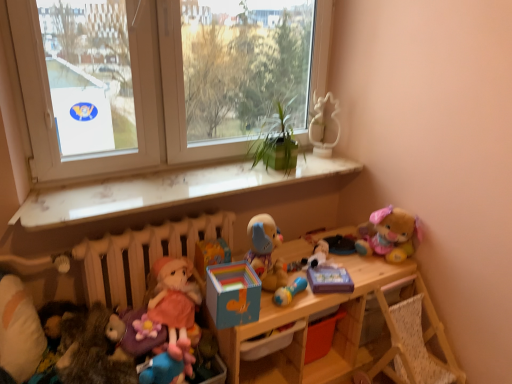
The image size is (512, 384). I want to click on unoccupied region to the right of white paper at upper left, positioned as the 2th window screen in right-to-left order, so click(x=161, y=189).